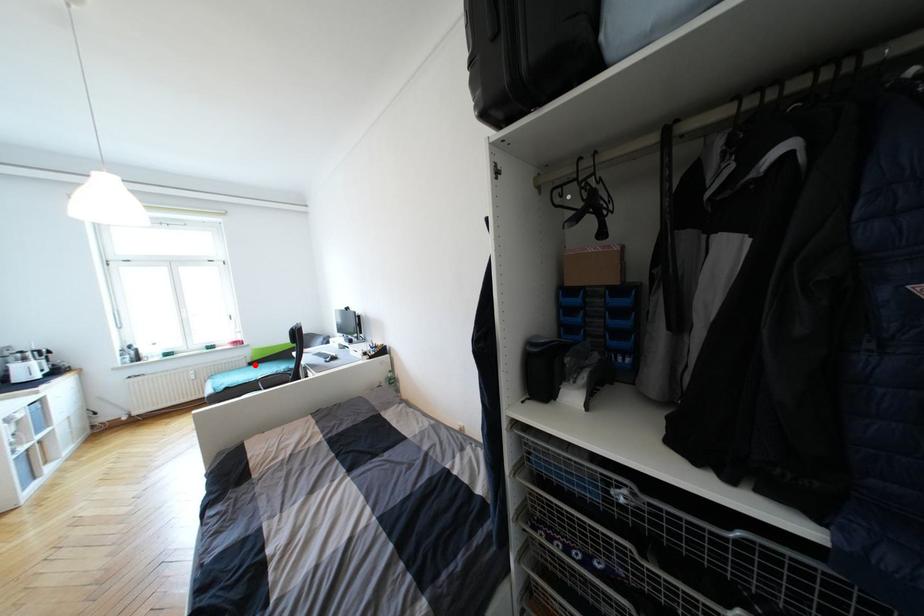
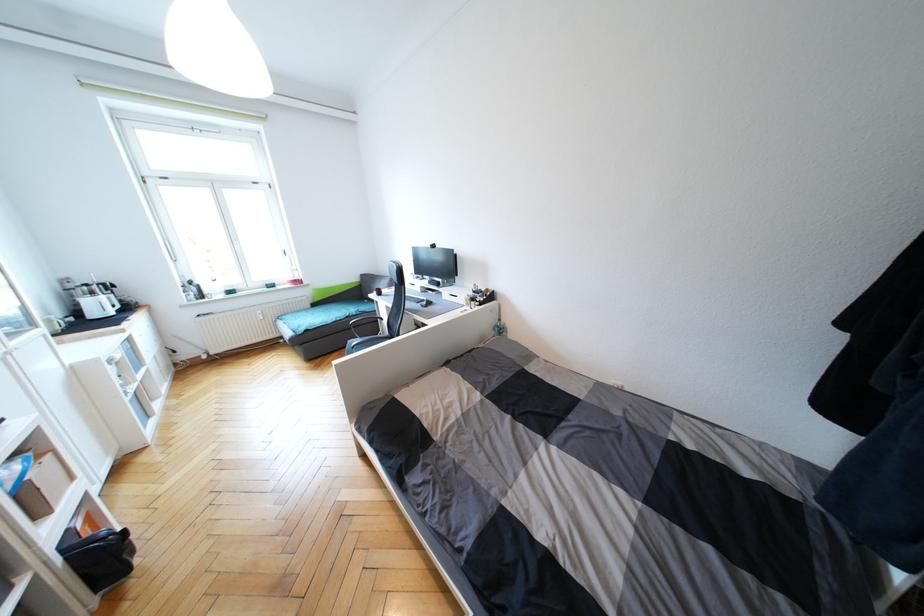
Question: I am providing you with two images of the same scene from different viewpoints. In image1, a red point is highlighted. Considering the same 3D point in image2, which of the following is correct?

Choices:
 (A) It is closer
 (B) It is farther

Answer: (A)